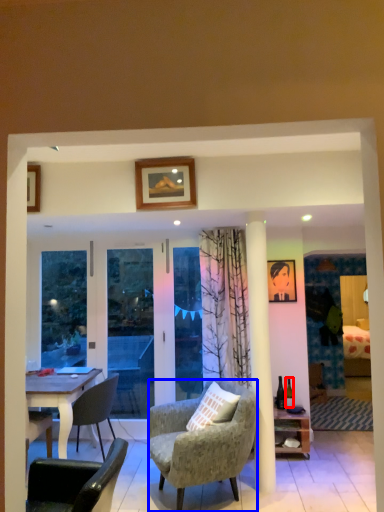
Question: Which of the following is the farthest to the observer, bottle (highlighted by a red box) or chair (highlighted by a blue box)?

Choices:
 (A) bottle
 (B) chair

Answer: (A)